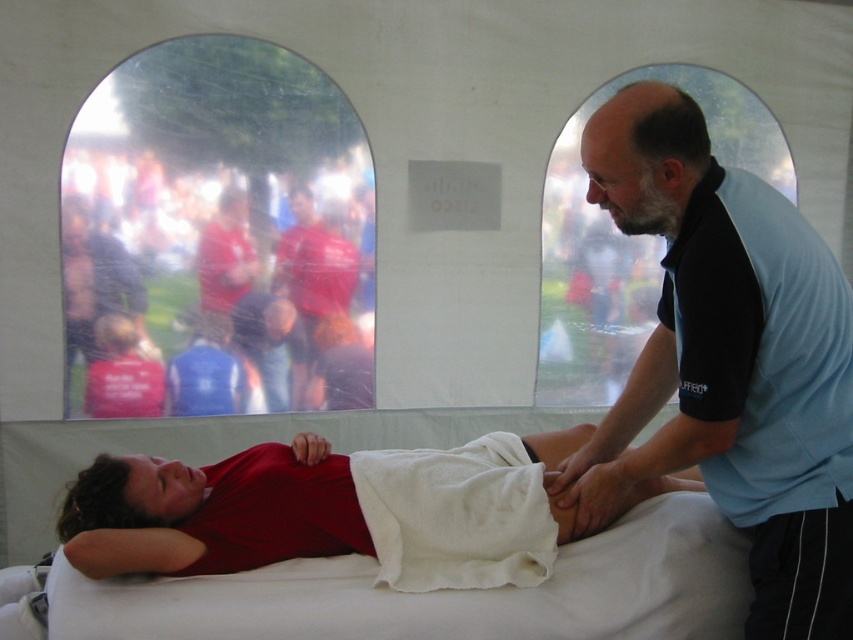
You are a medical professional inside the tent and need to locate two specific points marked in the scene. The first point is at coordinate point (151,528) and the second is at point (509,540). Which of these two points is closer to the entrance of the tent?

Point (151,528) is behind point (509,540), so the point (509,540) is closer to the entrance of the tent.

You are a healthcare worker in the tent and need to quickly locate the blue shirt at upper right and the red fabric shirt at center. Which shirt is closer to the entrance of the tent?

The blue shirt at upper right is in front of the red fabric shirt at center, so it is closer to the entrance of the tent.

You are a healthcare professional in the tent and need to cover the patient properly. Which item, the red smooth shirt at center or the white soft cloth at center, would be more suitable for covering the patient based on their size?

The red smooth shirt at center is larger in size than the white soft cloth at center, so it would be more suitable for covering the patient properly.